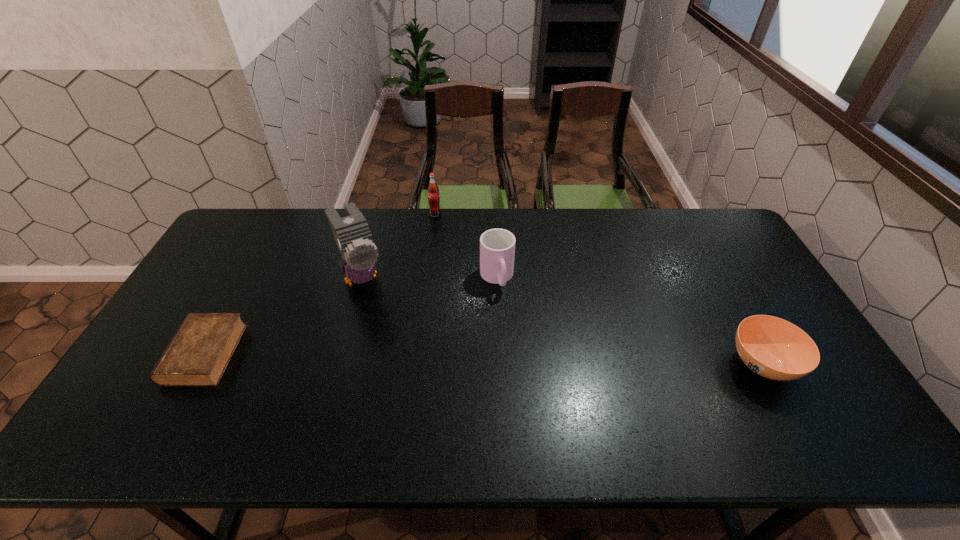
Locate an element on the screen. This screenshot has height=540, width=960. vacant space situated on the spine side of the diary is located at coordinates (149, 354).

At what (x,y) coordinates should I click in order to perform the action: click on free spot located 0.230m on the left of the rightmost object. Please return your answer as a coordinate pair (x, y). This screenshot has height=540, width=960. Looking at the image, I should click on (639, 364).

This screenshot has height=540, width=960. In order to click on free region located 0.310m at the beak of the tallest object in this screenshot , I will do `click(409, 382)`.

Where is `free space located 0.050m at the beak of the tallest object`? The image size is (960, 540). free space located 0.050m at the beak of the tallest object is located at coordinates (375, 314).

You are a GUI agent. You are given a task and a screenshot of the screen. Output one action in this format:
    pyautogui.click(x=<x>, y=<y>)
    Task: Click on the vacant position located at the beak of the tallest object
    This screenshot has height=540, width=960.
    Given the screenshot: What is the action you would take?
    pyautogui.click(x=377, y=319)

This screenshot has width=960, height=540. Find the location of `vacant space located 0.200m on the label of the third object from left to right`. vacant space located 0.200m on the label of the third object from left to right is located at coordinates (425, 253).

The width and height of the screenshot is (960, 540). Find the location of `vacant space located 0.130m on the label of the third object from left to right`. vacant space located 0.130m on the label of the third object from left to right is located at coordinates (428, 240).

The image size is (960, 540). In order to click on free space located 0.120m on the label of the third object from left to right in this screenshot , I will do `click(429, 238)`.

Locate an element on the screen. This screenshot has height=540, width=960. free point located with the handle on the side of the cup is located at coordinates (508, 321).

This screenshot has height=540, width=960. I want to click on free space located 0.080m with the handle on the side of the cup, so click(x=506, y=315).